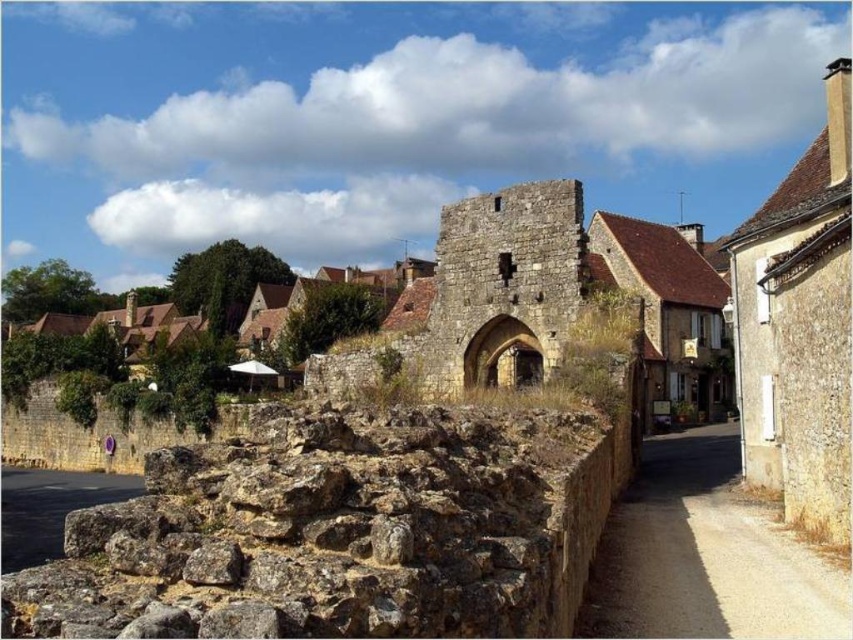
Can you confirm if brown rough stone wall at lower left is positioned to the left of brown stone alley at lower right?

Correct, you'll find brown rough stone wall at lower left to the left of brown stone alley at lower right.

Who is lower down, brown rough stone wall at lower left or brown stone alley at lower right?

Positioned lower is brown stone alley at lower right.

Is point (502, 579) farther from camera compared to point (648, 604)?

No, it is not.

This screenshot has height=640, width=853. What are the coordinates of `brown rough stone wall at lower left` in the screenshot? It's located at (339, 531).

Who is more forward, [320,563] or [4,547]?

Point [320,563] is more forward.

Can you confirm if brown rough stone wall at lower left is smaller than dark gray stone alley at lower left?

Indeed, brown rough stone wall at lower left has a smaller size compared to dark gray stone alley at lower left.

Where is `brown rough stone wall at lower left`? This screenshot has height=640, width=853. brown rough stone wall at lower left is located at coordinates [x=339, y=531].

Measure the distance between brown stone alley at lower right and camera.

38.41 meters

Measure the distance between brown stone alley at lower right and dark gray stone alley at lower left.

They are 182.99 feet apart.

Which is in front, point (764, 627) or point (57, 544)?

Point (764, 627) is more forward.

Where is `brown stone alley at lower right`? brown stone alley at lower right is located at coordinates (705, 556).